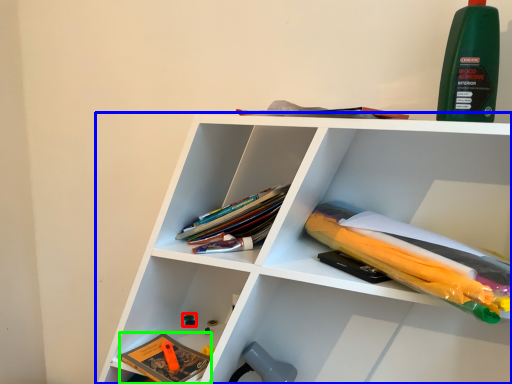
Question: Which object is the farthest from toy (highlighted by a red box)? Choose among these: shelf (highlighted by a blue box) or book (highlighted by a green box).

Choices:
 (A) shelf
 (B) book

Answer: (A)